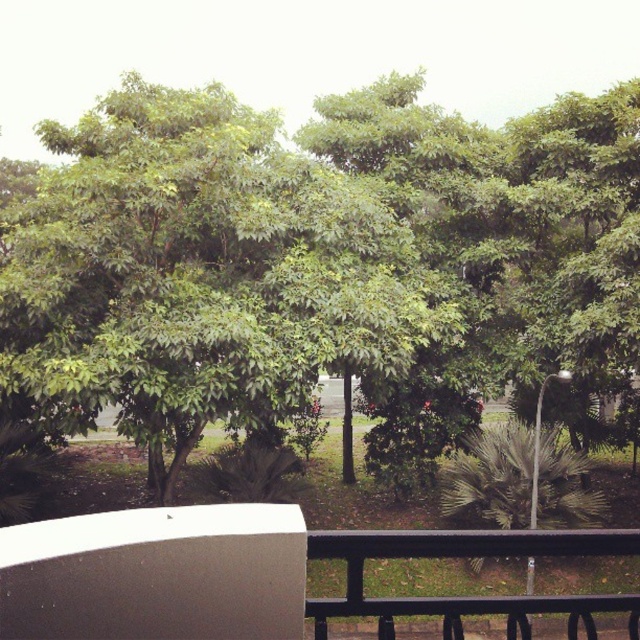
Question: Among these points, which one is farthest from the camera?

Choices:
 (A) (129, 579)
 (B) (326, 324)
 (C) (353, 572)

Answer: (B)

Question: Which point is farther to the camera?

Choices:
 (A) (355, 566)
 (B) (400, 193)
 (C) (588, 554)

Answer: (B)

Question: Does white matte balcony at lower left appear on the right side of black metal/rail at lower center?

Choices:
 (A) no
 (B) yes

Answer: (A)

Question: Can you confirm if green leafy tree at center is positioned below black metal/rail at lower center?

Choices:
 (A) yes
 (B) no

Answer: (B)

Question: Which object is positioned farthest from the white matte balcony at lower left?

Choices:
 (A) green leafy tree at center
 (B) black metal/rail at lower center

Answer: (A)

Question: Does white matte balcony at lower left lie behind black metal/rail at lower center?

Choices:
 (A) no
 (B) yes

Answer: (A)